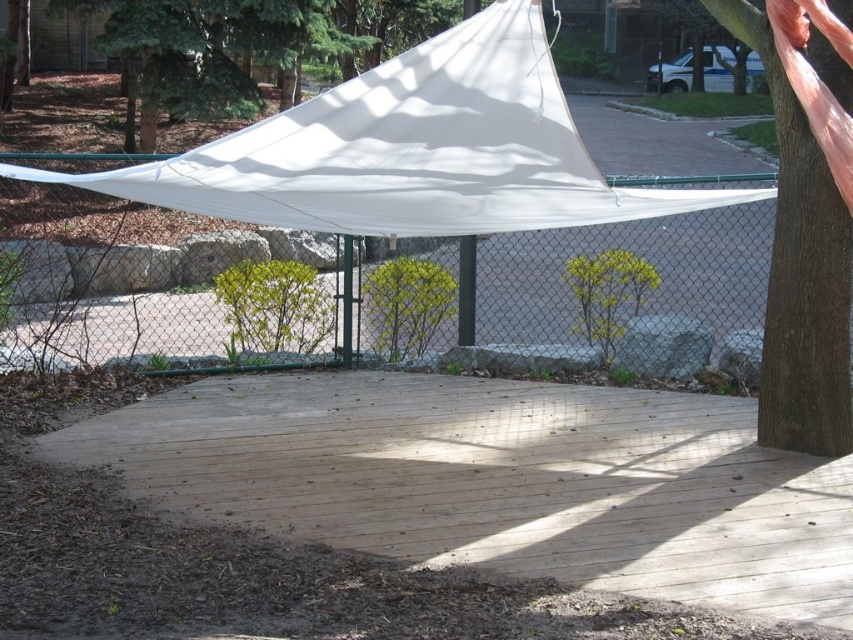
You are standing on the natural wood deck at center and want to reach the white fabric canopy at upper center. Which direction should you move to get closer to the canopy?

You should move upward to get closer to the white fabric canopy at upper center since the natural wood deck at center is below it.

You are a painter who needs to know which object is shorter between the white mesh fence at center and the white fabric canopy at upper center. Can you tell me which one is shorter?

The white mesh fence at center is shorter than the white fabric canopy at upper center.

You are standing on the natural wood deck at center and want to walk to the white mesh fence at center. In which direction should you move to reach it?

You should move to your left to reach the white mesh fence at center because the natural wood deck at center is positioned on the right side of the white mesh fence at center.